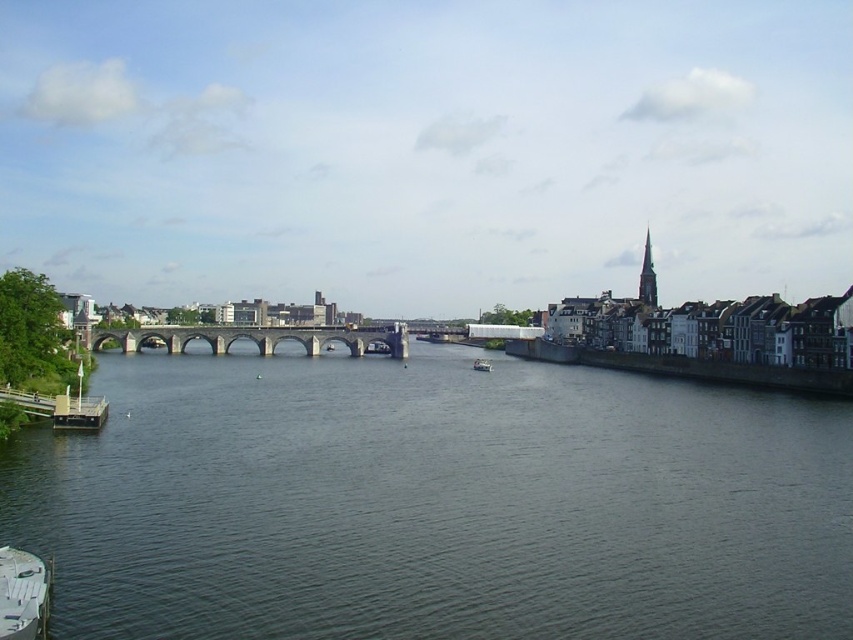
Question: Does stone arch bridge at center appear over white plastic boat at center?

Choices:
 (A) no
 (B) yes

Answer: (B)

Question: Can you confirm if stone arch bridge at center is bigger than white plastic boat at center?

Choices:
 (A) yes
 (B) no

Answer: (A)

Question: Which object is farther from the camera taking this photo?

Choices:
 (A) stone arch bridge at center
 (B) white plastic boat at lower left
 (C) metallic gray boat at lower left
 (D) white plastic boat at center

Answer: (A)

Question: Can you confirm if dark gray water at center is positioned to the right of white plastic boat at center?

Choices:
 (A) yes
 (B) no

Answer: (B)

Question: Which object is farther from the camera taking this photo?

Choices:
 (A) dark gray water at center
 (B) white plastic boat at lower left
 (C) white plastic boat at center
 (D) metallic gray boat at lower left

Answer: (C)

Question: Estimate the real-world distances between objects in this image. Which object is farther from the stone arch bridge at center?

Choices:
 (A) metallic gray boat at lower left
 (B) white plastic boat at lower left

Answer: (B)